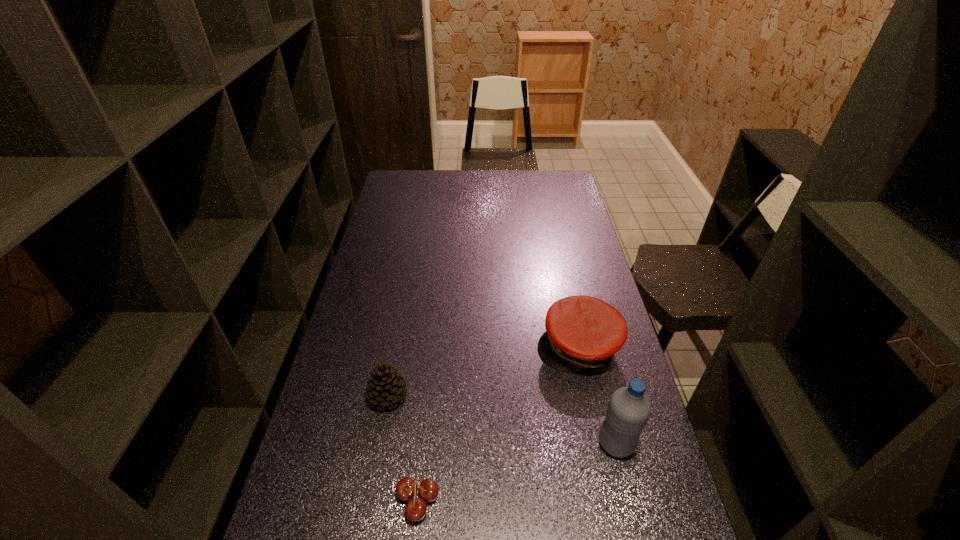
Where is `the nearest object`? The image size is (960, 540). the nearest object is located at coordinates (406, 488).

At what (x,y) coordinates should I click in order to perform the action: click on cherry. Please return your answer as a coordinate pair (x, y). The width and height of the screenshot is (960, 540). Looking at the image, I should click on (406, 488).

Where is `the second nearest object`? the second nearest object is located at coordinates (628, 410).

Image resolution: width=960 pixels, height=540 pixels. In order to click on water bottle in this screenshot , I will do `click(628, 410)`.

Find the location of a particular element. the farthest object is located at coordinates (582, 332).

Find the location of `the leftmost object`. the leftmost object is located at coordinates (385, 387).

This screenshot has height=540, width=960. I want to click on pinecone, so click(385, 387).

The width and height of the screenshot is (960, 540). In order to click on vacant region located on the leaves of the shortest object in this screenshot , I will do `click(349, 497)`.

You are a GUI agent. You are given a task and a screenshot of the screen. Output one action in this format:
    pyautogui.click(x=<x>, y=<y>)
    Task: Click on the vacant space located on the leaves of the shortest object
    The width and height of the screenshot is (960, 540).
    Given the screenshot: What is the action you would take?
    pyautogui.click(x=333, y=497)

Identify the location of vacant region located 0.100m on the leaves of the shortest object. Image resolution: width=960 pixels, height=540 pixels. (354, 497).